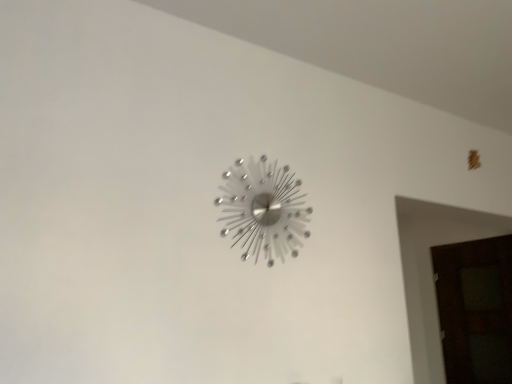
The height and width of the screenshot is (384, 512). I want to click on dark wood door at right, so click(475, 309).

The height and width of the screenshot is (384, 512). Describe the element at coordinates (475, 309) in the screenshot. I see `dark wood door at right` at that location.

Measure the distance between dark wood door at right and camera.

They are 3.53 meters apart.

The image size is (512, 384). What are the coordinates of `silver metallic wall clock at center` in the screenshot? It's located at (264, 209).

Describe the element at coordinates (264, 209) in the screenshot. This screenshot has width=512, height=384. I see `silver metallic wall clock at center` at that location.

The width and height of the screenshot is (512, 384). Identify the location of dark wood door at right. point(475,309).

Is silver metallic wall clock at center at the right side of dark wood door at right?

No, silver metallic wall clock at center is not to the right of dark wood door at right.

Is the position of silver metallic wall clock at center less distant than that of dark wood door at right?

Yes, it is in front of dark wood door at right.

Considering the points (242, 160) and (466, 357), which point is behind, point (242, 160) or point (466, 357)?

The point (466, 357) is behind.

From the image's perspective, is silver metallic wall clock at center below dark wood door at right?

No.

From a real-world perspective, which object stands above the other?

silver metallic wall clock at center.

Which of these two, silver metallic wall clock at center or dark wood door at right, is thinner?

silver metallic wall clock at center is thinner.

Can you confirm if silver metallic wall clock at center is taller than dark wood door at right?

No.

Considering the sizes of objects silver metallic wall clock at center and dark wood door at right in the image provided, who is bigger, silver metallic wall clock at center or dark wood door at right?

dark wood door at right.

Choose the correct answer: Is silver metallic wall clock at center inside dark wood door at right or outside it?

silver metallic wall clock at center cannot be found inside dark wood door at right.

Is the surface of silver metallic wall clock at center in direct contact with dark wood door at right?

No, silver metallic wall clock at center is not touching dark wood door at right.

Is silver metallic wall clock at center turned away from dark wood door at right?

No, dark wood door at right is not at the back of silver metallic wall clock at center.

How much distance is there between silver metallic wall clock at center and dark wood door at right?

A distance of 9.11 feet exists between silver metallic wall clock at center and dark wood door at right.

This screenshot has width=512, height=384. In the image, there is a dark wood door at right. Identify the location of wall clock above it (from the image's perspective). (264, 209).

Does dark wood door at right appear on the left side of silver metallic wall clock at center?

In fact, dark wood door at right is to the right of silver metallic wall clock at center.

Based on the photo, which is in front, dark wood door at right or silver metallic wall clock at center?

Positioned in front is silver metallic wall clock at center.

Which is behind, point (459, 365) or point (307, 220)?

The point (459, 365) is behind.

From the image's perspective, does dark wood door at right appear lower than silver metallic wall clock at center?

Answer: Yes.

From a real-world perspective, relative to silver metallic wall clock at center, is dark wood door at right vertically above or below?

Clearly, from a real-world perspective, dark wood door at right is below silver metallic wall clock at center.

Which of these two, dark wood door at right or silver metallic wall clock at center, is thinner?

Thinner between the two is silver metallic wall clock at center.

Considering the relative sizes of dark wood door at right and silver metallic wall clock at center in the image provided, is dark wood door at right taller than silver metallic wall clock at center?

Indeed, dark wood door at right has a greater height compared to silver metallic wall clock at center.

Who is bigger, dark wood door at right or silver metallic wall clock at center?

dark wood door at right.

Is dark wood door at right not within silver metallic wall clock at center?

dark wood door at right lies outside silver metallic wall clock at center's area.

Would you consider dark wood door at right to be distant from silver metallic wall clock at center?

Indeed, dark wood door at right is not near silver metallic wall clock at center.

Looking at this image, is dark wood door at right oriented away from silver metallic wall clock at center?

No.

How many degrees apart are the facing directions of dark wood door at right and silver metallic wall clock at center?

The facing directions of dark wood door at right and silver metallic wall clock at center are 90.5 degrees apart.

Where is `door lying behind the silver metallic wall clock at center`? This screenshot has width=512, height=384. door lying behind the silver metallic wall clock at center is located at coordinates (475, 309).

What are the coordinates of `door below the silver metallic wall clock at center (from a real-world perspective)` in the screenshot? It's located at (475, 309).

Image resolution: width=512 pixels, height=384 pixels. I want to click on wall clock on the left of the dark wood door at right, so click(264, 209).